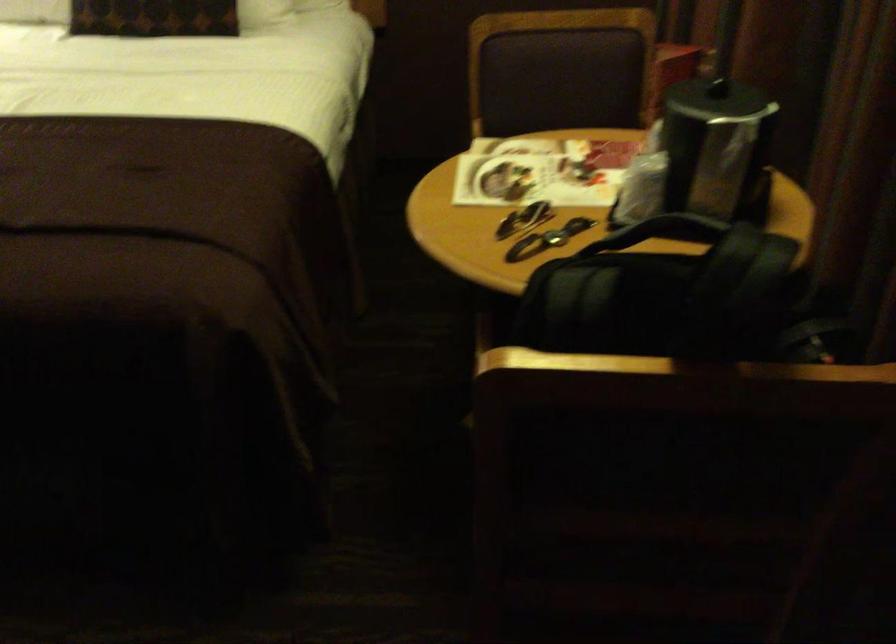
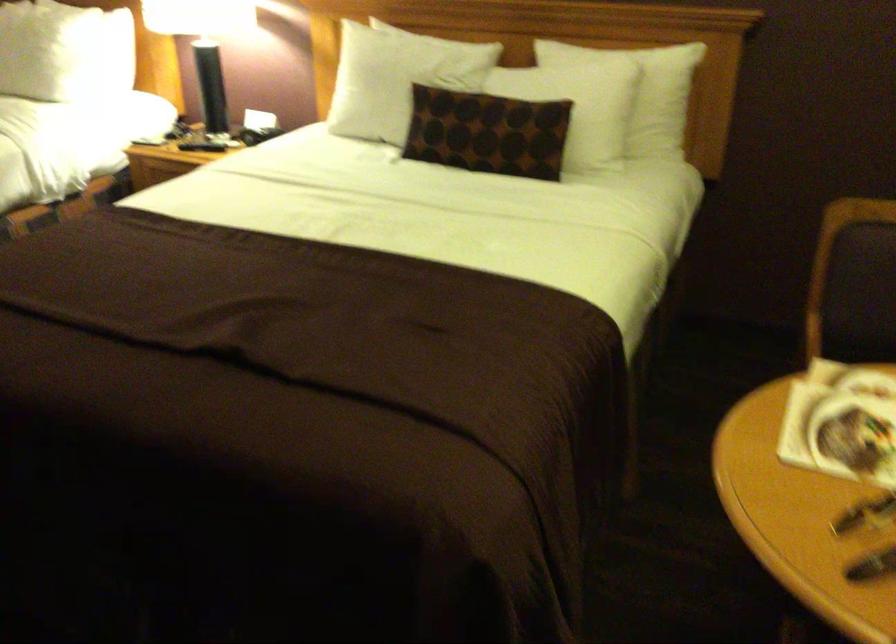
Question: The first image is from the beginning of the video and the second image is from the end. How did the camera likely rotate when shooting the video?

Choices:
 (A) Left
 (B) Right
 (C) Up
 (D) Down

Answer: (A)